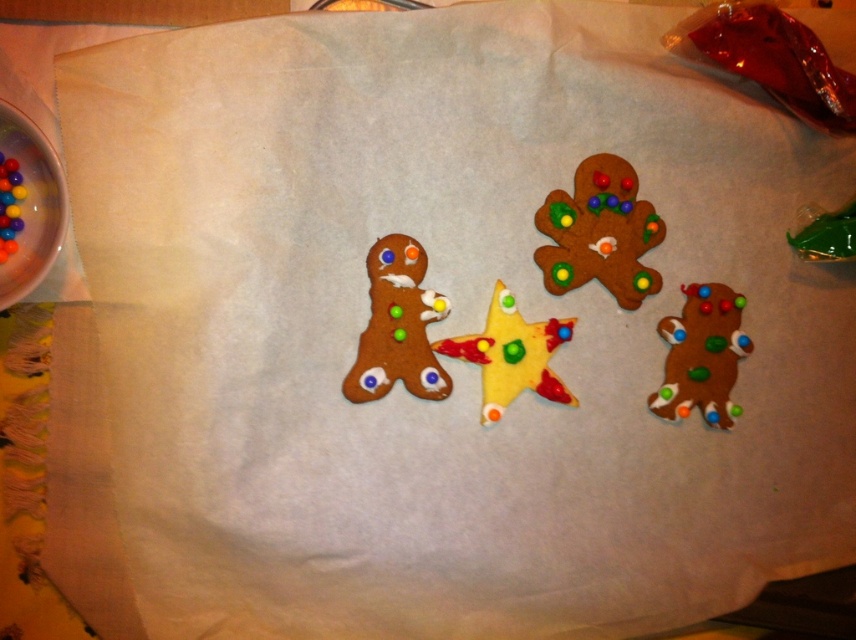
Question: Which point is closer to the camera?

Choices:
 (A) (669, 397)
 (B) (631, 198)
 (C) (9, 184)
 (D) (568, 332)

Answer: (C)

Question: Does yellow glossy star at center have a greater width compared to glossy multicolored beads at left?

Choices:
 (A) no
 (B) yes

Answer: (B)

Question: Which point appears closest to the camera in this image?

Choices:
 (A) (667, 365)
 (B) (0, 232)
 (C) (608, 195)

Answer: (B)

Question: Does matte brown gingerbread man at lower right have a smaller size compared to glossy multicolored beads at left?

Choices:
 (A) no
 (B) yes

Answer: (A)

Question: Considering the relative positions of matte brown gingerbread man at upper right and matte brown gingerbread man at lower right in the image provided, where is matte brown gingerbread man at upper right located with respect to matte brown gingerbread man at lower right?

Choices:
 (A) right
 (B) left

Answer: (B)

Question: Which point is closer to the camera taking this photo?

Choices:
 (A) (542, 260)
 (B) (568, 392)
 (C) (15, 250)

Answer: (C)